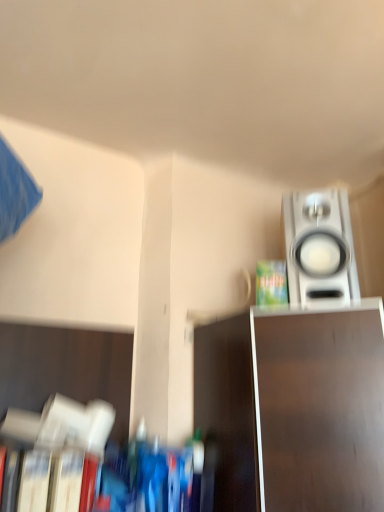
Measure the distance between green matte paperback book at upper right and camera.

1.26 meters.

Find the location of a particular element. The height and width of the screenshot is (512, 384). hardcover book at lower left is located at coordinates (53, 455).

The height and width of the screenshot is (512, 384). I want to click on green matte paperback book at upper right, so click(271, 283).

Which object is further away from the camera taking this photo, green matte paperback book at upper right or satin silver speaker at upper right?

green matte paperback book at upper right is more distant.

In the scene shown: Considering the relative sizes of green matte paperback book at upper right and satin silver speaker at upper right in the image provided, is green matte paperback book at upper right thinner than satin silver speaker at upper right?

Yes, green matte paperback book at upper right is thinner than satin silver speaker at upper right.

Does green matte paperback book at upper right turn towards satin silver speaker at upper right?

No, green matte paperback book at upper right does not turn towards satin silver speaker at upper right.

From the image's perspective, which object appears higher, green matte paperback book at upper right or satin silver speaker at upper right?

satin silver speaker at upper right.

Considering the relative sizes of hardcover book at lower left and satin silver speaker at upper right in the image provided, is hardcover book at lower left wider than satin silver speaker at upper right?

No, hardcover book at lower left is not wider than satin silver speaker at upper right.

From the image's perspective, is hardcover book at lower left located above or below satin silver speaker at upper right?

From the image's perspective, hardcover book at lower left appears below satin silver speaker at upper right.

Considering the positions of objects hardcover book at lower left and satin silver speaker at upper right in the image provided, who is more to the right, hardcover book at lower left or satin silver speaker at upper right?

Positioned to the right is satin silver speaker at upper right.

Can you confirm if hardcover book at lower left is taller than satin silver speaker at upper right?

No.

Can hardcover book at lower left be found inside green matte paperback book at upper right?

Definitely not — hardcover book at lower left is not inside green matte paperback book at upper right.

From a real-world perspective, is green matte paperback book at upper right over hardcover book at lower left?

Yes, from a real-world perspective, green matte paperback book at upper right is on top of hardcover book at lower left.

From the image's perspective, which is above, green matte paperback book at upper right or hardcover book at lower left?

green matte paperback book at upper right appears higher in the image.

Is green matte paperback book at upper right touching hardcover book at lower left?

No, green matte paperback book at upper right is not making contact with hardcover book at lower left.

Which object is thinner, satin silver speaker at upper right or green matte paperback book at upper right?

green matte paperback book at upper right.

Based on their positions, is satin silver speaker at upper right located to the left or right of green matte paperback book at upper right?

In the image, satin silver speaker at upper right appears on the right side of green matte paperback book at upper right.

Who is taller, satin silver speaker at upper right or green matte paperback book at upper right?

satin silver speaker at upper right.

Could you measure the distance between satin silver speaker at upper right and green matte paperback book at upper right?

5.23 inches.

Which object is closer to the camera, hardcover book at lower left or green matte paperback book at upper right?

hardcover book at lower left is in front.

Are hardcover book at lower left and green matte paperback book at upper right located far from each other?

hardcover book at lower left is actually quite close to green matte paperback book at upper right.

From a real-world perspective, is hardcover book at lower left physically above green matte paperback book at upper right?

No, from a real-world perspective, hardcover book at lower left is not over green matte paperback book at upper right

Is hardcover book at lower left facing away from green matte paperback book at upper right?

No, hardcover book at lower left's orientation is not away from green matte paperback book at upper right.

Would you say satin silver speaker at upper right is outside hardcover book at lower left?

Yes, satin silver speaker at upper right is located beyond the bounds of hardcover book at lower left.

Based on the photo, which is more to the left, satin silver speaker at upper right or hardcover book at lower left?

From the viewer's perspective, hardcover book at lower left appears more on the left side.

Where is `book below the satin silver speaker at upper right (from a real-world perspective)`? book below the satin silver speaker at upper right (from a real-world perspective) is located at coordinates (53, 455).

Is satin silver speaker at upper right in front of metallic silver tv stand at lower right?

No, satin silver speaker at upper right is further to the viewer.

Is satin silver speaker at upper right touching metallic silver tv stand at lower right?

No, satin silver speaker at upper right is not next to metallic silver tv stand at lower right.

Which object is positioned more to the right, satin silver speaker at upper right or metallic silver tv stand at lower right?

From the viewer's perspective, satin silver speaker at upper right appears more on the right side.

Which of these two, satin silver speaker at upper right or metallic silver tv stand at lower right, is thinner?

Result: satin silver speaker at upper right.

The width and height of the screenshot is (384, 512). Identify the location of paperback book that is under the satin silver speaker at upper right (from a real-world perspective). click(x=271, y=283).

I want to click on home appliance above the hardcover book at lower left (from the image's perspective), so click(319, 248).

When comparing their distances from metallic silver tv stand at lower right, does green matte paperback book at upper right or hardcover book at lower left seem further?

hardcover book at lower left is positioned further to the anchor metallic silver tv stand at lower right.

When comparing their distances from green matte paperback book at upper right, does satin silver speaker at upper right or hardcover book at lower left seem further?

The object further to green matte paperback book at upper right is hardcover book at lower left.

From the image, which object appears to be nearer to hardcover book at lower left, satin silver speaker at upper right or green matte paperback book at upper right?

green matte paperback book at upper right lies closer to hardcover book at lower left than the other object.

Which object lies further to the anchor point satin silver speaker at upper right, green matte paperback book at upper right or metallic silver tv stand at lower right?

Among the two, metallic silver tv stand at lower right is located further to satin silver speaker at upper right.

From the image, which object appears to be farther from metallic silver tv stand at lower right, hardcover book at lower left or green matte paperback book at upper right?

Based on the image, hardcover book at lower left appears to be further to metallic silver tv stand at lower right.

Which object lies further to the anchor point hardcover book at lower left, metallic silver tv stand at lower right or satin silver speaker at upper right?

satin silver speaker at upper right lies further to hardcover book at lower left than the other object.

Looking at the image, which one is located closer to satin silver speaker at upper right, hardcover book at lower left or metallic silver tv stand at lower right?

Among the two, metallic silver tv stand at lower right is located nearer to satin silver speaker at upper right.

Which object lies nearer to the anchor point hardcover book at lower left, metallic silver tv stand at lower right or green matte paperback book at upper right?

Among the two, metallic silver tv stand at lower right is located nearer to hardcover book at lower left.

Locate an element on the screen. The height and width of the screenshot is (512, 384). furniture situated between hardcover book at lower left and satin silver speaker at upper right from left to right is located at coordinates (293, 408).

The height and width of the screenshot is (512, 384). I want to click on paperback book between hardcover book at lower left and satin silver speaker at upper right from left to right, so click(271, 283).

What are the coordinates of `home appliance located between metallic silver tv stand at lower right and green matte paperback book at upper right in the depth direction` in the screenshot? It's located at (319, 248).

You are a GUI agent. You are given a task and a screenshot of the screen. Output one action in this format:
    pyautogui.click(x=<x>, y=<y>)
    Task: Click on the paperback book situated between hardcover book at lower left and metallic silver tv stand at lower right from left to right
    This screenshot has width=384, height=512.
    Given the screenshot: What is the action you would take?
    pyautogui.click(x=271, y=283)